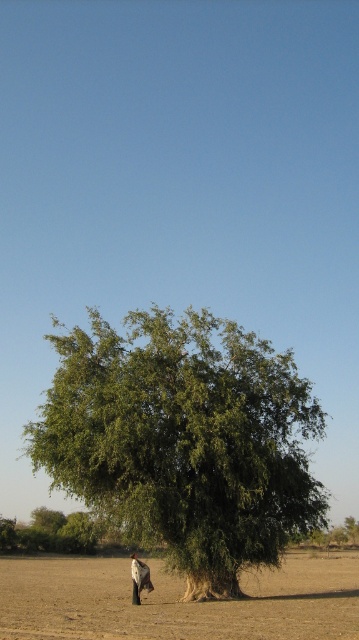
Can you confirm if green leafy tree at center is thinner than dark brown fur at lower center?

Incorrect, green leafy tree at center's width is not less than dark brown fur at lower center's.

Does point (114, 509) come farther from viewer compared to point (133, 584)?

Yes.

Identify the location of green leafy tree at center. The height and width of the screenshot is (640, 359). 184,440.

Which is above, brown sandy dirt at lower center or dark brown fur at lower center?

dark brown fur at lower center

Can you confirm if brown sandy dirt at lower center is positioned above dark brown fur at lower center?

Incorrect, brown sandy dirt at lower center is not positioned above dark brown fur at lower center.

Locate an element on the screen. The image size is (359, 640). brown sandy dirt at lower center is located at coordinates (176, 602).

Does green leafy tree at center appear on the left side of brown sandy dirt at lower center?

Yes, green leafy tree at center is to the left of brown sandy dirt at lower center.

Which of these two, green leafy tree at center or brown sandy dirt at lower center, stands taller?

brown sandy dirt at lower center is taller.

The height and width of the screenshot is (640, 359). Describe the element at coordinates (184, 440) in the screenshot. I see `green leafy tree at center` at that location.

Locate an element on the screen. green leafy tree at center is located at coordinates (184, 440).